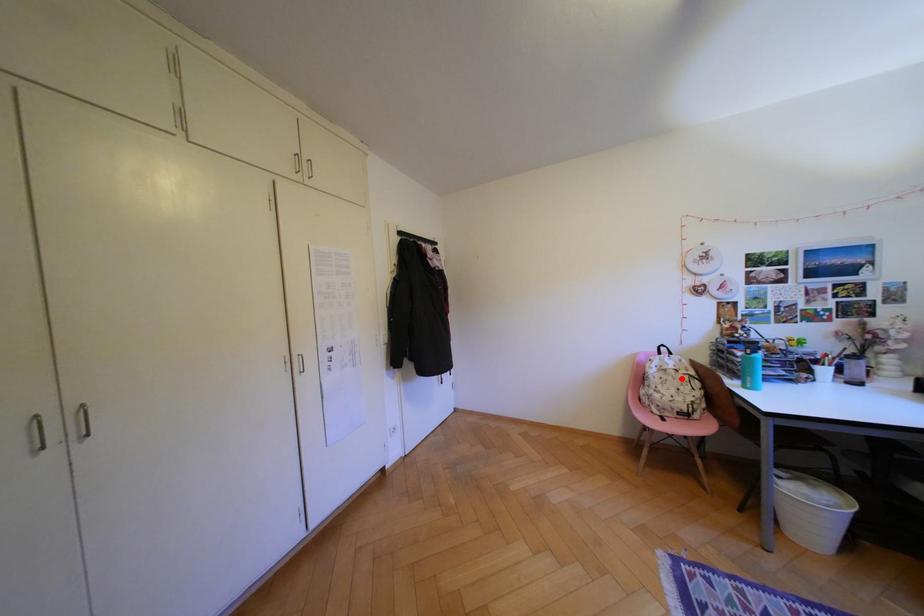
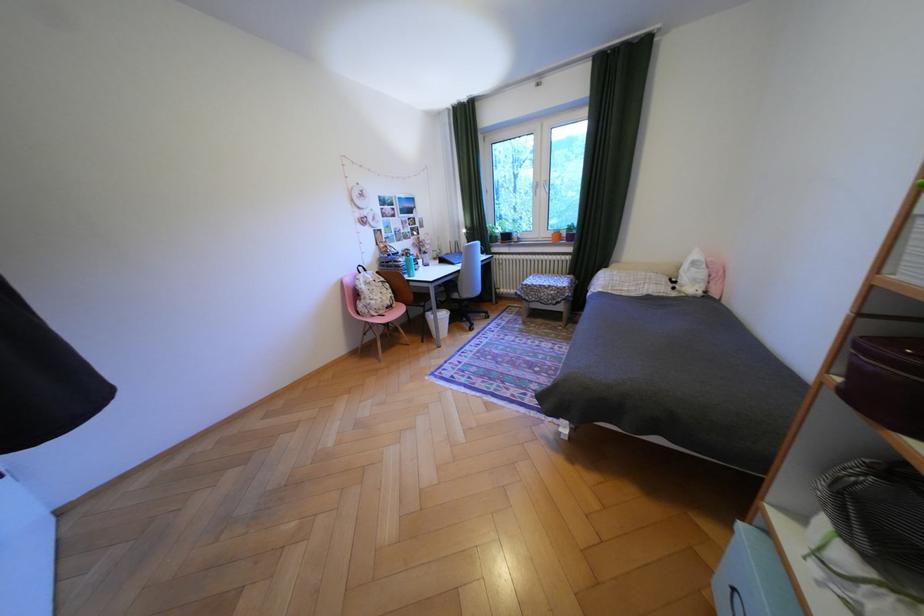
Question: A red point is marked in image1. In image2, is the corresponding 3D point closer to the camera or farther? Reply with the corresponding letter.

Choices:
 (A) The corresponding 3D point is closer.
 (B) The corresponding 3D point is farther.

Answer: (A)